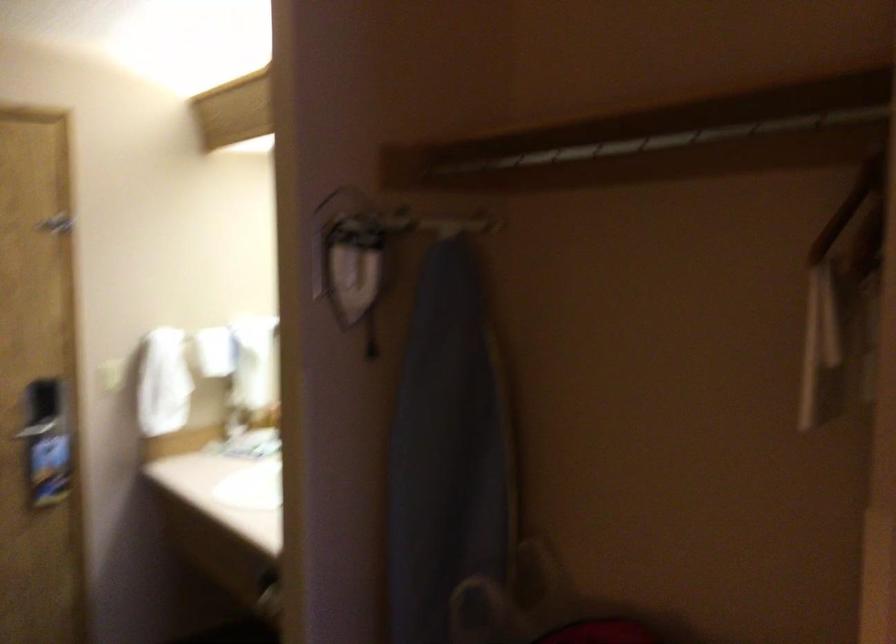
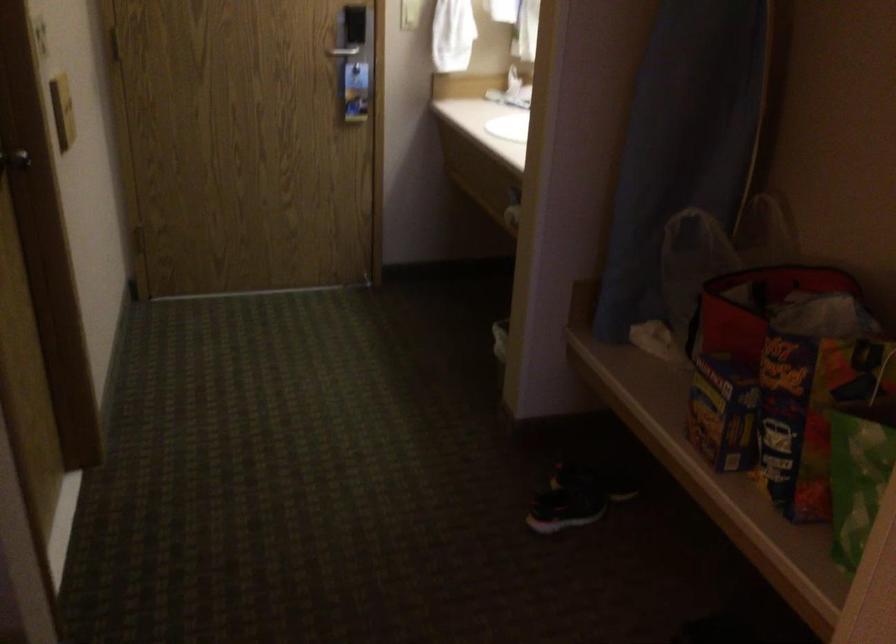
First-person continuous shooting, in which direction is the camera rotating?

The camera's rotation is toward left-down.